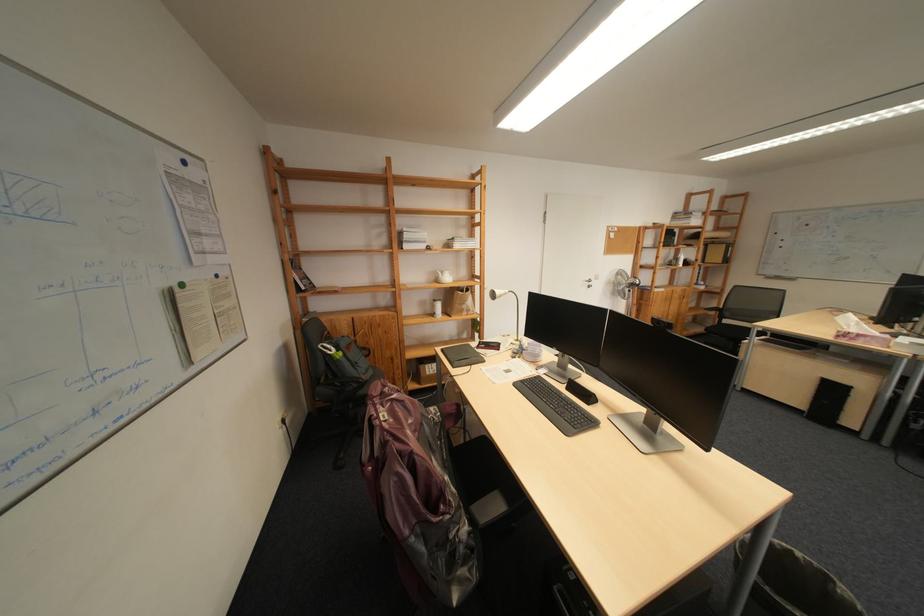
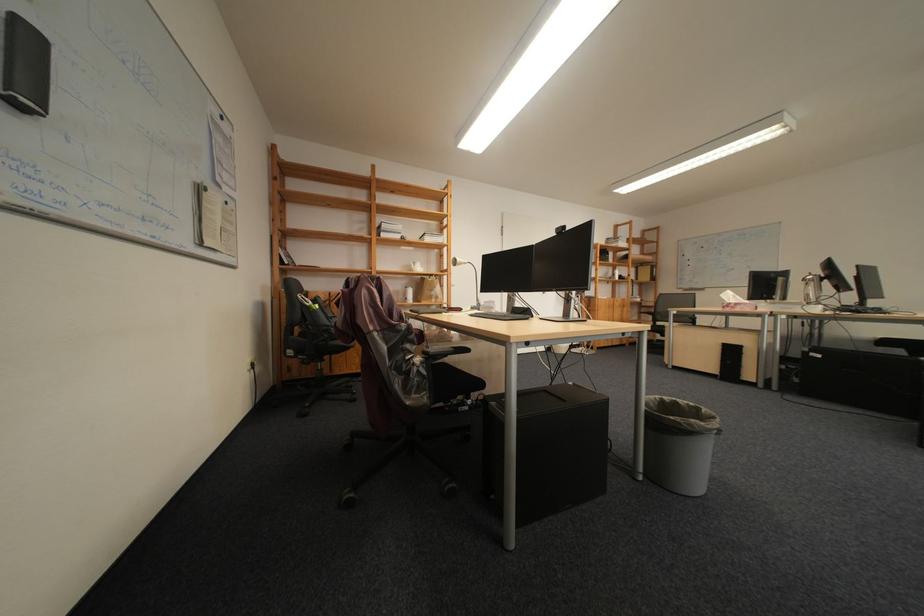
Locate, in the second image, the point that corresponds to (x=529, y=386) in the first image.

(484, 317)